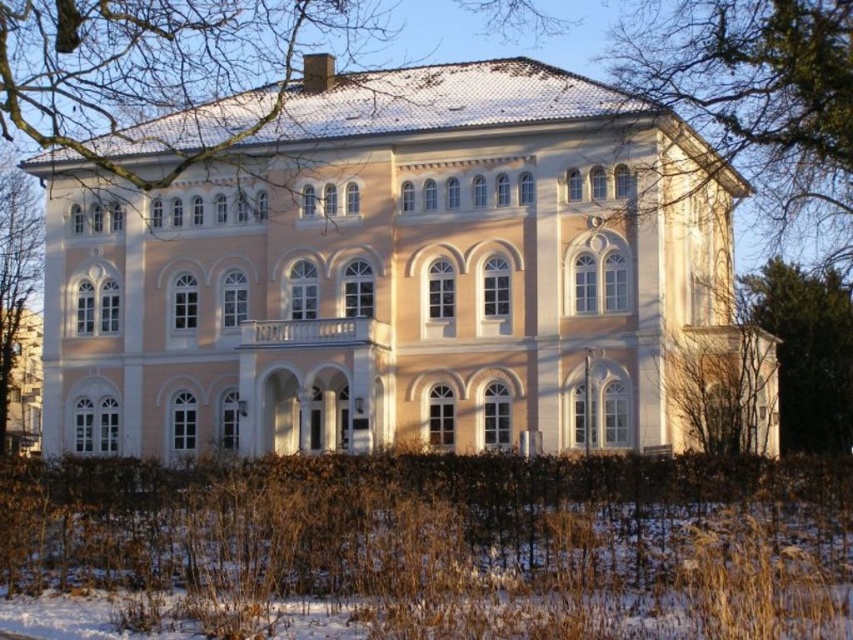
You are standing in front of the grand two story building and notice a point labeled as point (155, 77). What is located at this point?

The point (155, 77) indicates bare branches at upper left.

You are standing in front of the grand building and notice two green leafy trees on either side. Which tree is nearer to you, the green leafy tree at right or the green leafy tree at left?

The green leafy tree at right is closer to the viewer than the green leafy tree at left, so the tree at the right is nearer to you.